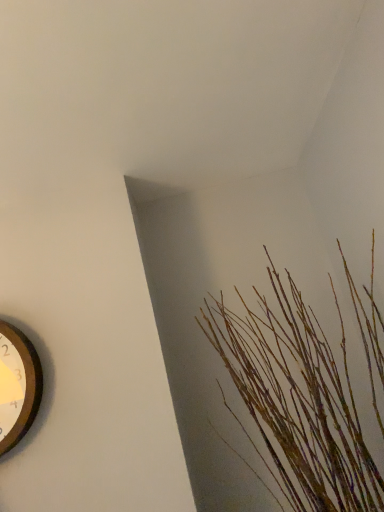
Question: In the image, is brown textured sticks at upper right positioned in front of or behind wooden clock at left?

Choices:
 (A) front
 (B) behind

Answer: (A)

Question: Considering the positions of brown textured sticks at upper right and wooden clock at left in the image, is brown textured sticks at upper right bigger or smaller than wooden clock at left?

Choices:
 (A) big
 (B) small

Answer: (A)

Question: From a real-world perspective, is brown textured sticks at upper right above or below wooden clock at left?

Choices:
 (A) below
 (B) above

Answer: (A)

Question: From the image's perspective, is wooden clock at left above or below brown textured sticks at upper right?

Choices:
 (A) above
 (B) below

Answer: (B)

Question: Considering the positions of wooden clock at left and brown textured sticks at upper right in the image, is wooden clock at left taller or shorter than brown textured sticks at upper right?

Choices:
 (A) tall
 (B) short

Answer: (B)

Question: Is wooden clock at left inside the boundaries of brown textured sticks at upper right, or outside?

Choices:
 (A) inside
 (B) outside

Answer: (B)

Question: Is point (6, 325) closer or farther from the camera than point (344, 349)?

Choices:
 (A) farther
 (B) closer

Answer: (A)